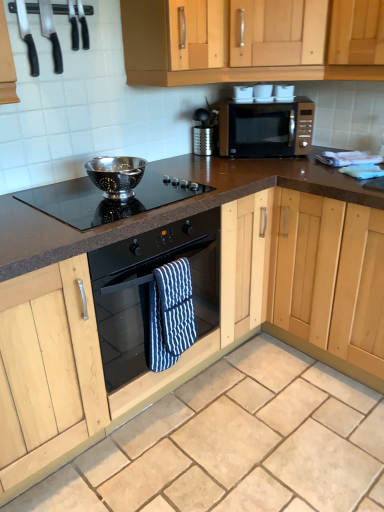
Image resolution: width=384 pixels, height=512 pixels. I want to click on empty space that is ontop of beige granite countertop at center (from a real-world perspective), so click(242, 433).